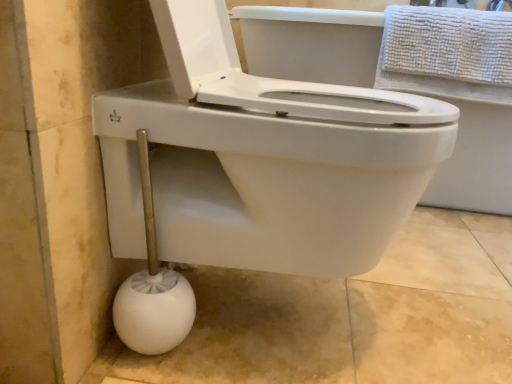
Question: Is white plastic toilet brush at lower left in front of or behind white textured towel at upper right in the image?

Choices:
 (A) behind
 (B) front

Answer: (B)

Question: Considering the positions of point (151, 334) and point (465, 92), is point (151, 334) closer or farther from the camera than point (465, 92)?

Choices:
 (A) closer
 (B) farther

Answer: (A)

Question: In terms of width, does white plastic toilet brush at lower left look wider or thinner when compared to white textured towel at upper right?

Choices:
 (A) wide
 (B) thin

Answer: (B)

Question: Is white textured towel at upper right bigger or smaller than white plastic toilet brush at lower left?

Choices:
 (A) big
 (B) small

Answer: (A)

Question: Choose the correct answer: Is white textured towel at upper right inside white plastic toilet brush at lower left or outside it?

Choices:
 (A) outside
 (B) inside

Answer: (A)

Question: In the image, is white textured towel at upper right on the left side or the right side of white plastic toilet brush at lower left?

Choices:
 (A) left
 (B) right

Answer: (B)

Question: From the image's perspective, is white textured towel at upper right located above or below white plastic toilet brush at lower left?

Choices:
 (A) above
 (B) below

Answer: (A)